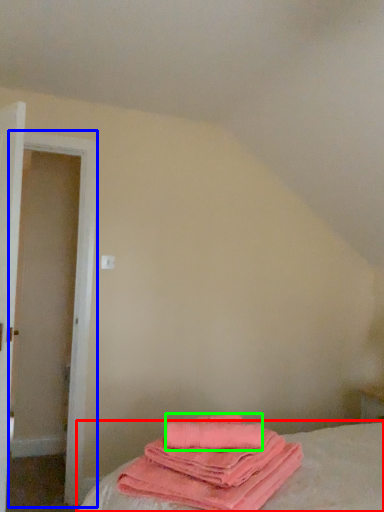
Question: Which object is the farthest from bed (highlighted by a red box)? Choose among these: door (highlighted by a blue box) or beach towel (highlighted by a green box).

Choices:
 (A) door
 (B) beach towel

Answer: (A)